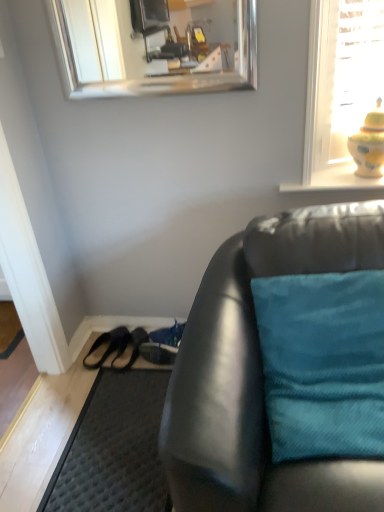
Question: Is teal fabric pillow at right positioned before matte black couch at lower right?

Choices:
 (A) no
 (B) yes

Answer: (A)

Question: Can you see teal fabric pillow at right touching matte black couch at lower right?

Choices:
 (A) no
 (B) yes

Answer: (A)

Question: Can you confirm if teal fabric pillow at right is wider than matte black couch at lower right?

Choices:
 (A) no
 (B) yes

Answer: (A)

Question: Is teal fabric pillow at right located outside matte black couch at lower right?

Choices:
 (A) yes
 (B) no

Answer: (B)

Question: From the image's perspective, is teal fabric pillow at right beneath matte black couch at lower right?

Choices:
 (A) no
 (B) yes

Answer: (A)

Question: Considering the positions of matte black couch at lower right and yellow glazed vase at upper right in the image, is matte black couch at lower right taller or shorter than yellow glazed vase at upper right?

Choices:
 (A) short
 (B) tall

Answer: (B)

Question: From the image's perspective, is matte black couch at lower right positioned above or below yellow glazed vase at upper right?

Choices:
 (A) below
 (B) above

Answer: (A)

Question: From a real-world perspective, is matte black couch at lower right positioned above or below yellow glazed vase at upper right?

Choices:
 (A) above
 (B) below

Answer: (B)

Question: Looking at the image, does matte black couch at lower right seem bigger or smaller compared to yellow glazed vase at upper right?

Choices:
 (A) big
 (B) small

Answer: (A)

Question: Does point (119, 326) appear closer or farther from the camera than point (173, 327)?

Choices:
 (A) closer
 (B) farther

Answer: (B)

Question: Looking at their shapes, would you say black leather shoe at lower left, the 3th shoe from the right, is wider or thinner than shiny blue shoe at lower center, the first shoe positioned from the right?

Choices:
 (A) thin
 (B) wide

Answer: (A)

Question: Is black leather shoe at lower left, which appears as the first shoe when viewed from the left, to the left or to the right of shiny blue shoe at lower center, the first shoe positioned from the right, in the image?

Choices:
 (A) left
 (B) right

Answer: (A)

Question: Is black leather shoe at lower left, which appears as the first shoe when viewed from the left, inside the boundaries of shiny blue shoe at lower center, the first shoe positioned from the right, or outside?

Choices:
 (A) outside
 (B) inside

Answer: (A)

Question: Looking at the image, does dark gray textured doormat at lower left seem bigger or smaller compared to teal fabric pillow at right?

Choices:
 (A) big
 (B) small

Answer: (B)

Question: Relative to teal fabric pillow at right, is dark gray textured doormat at lower left in front or behind?

Choices:
 (A) front
 (B) behind

Answer: (B)